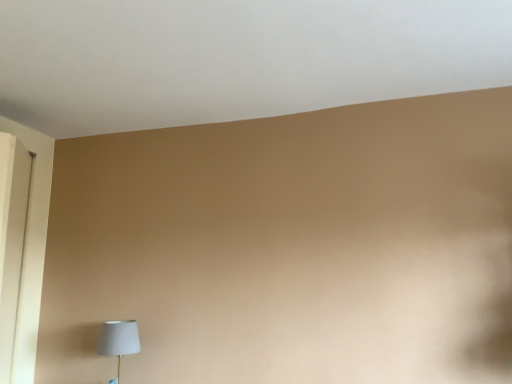
In order to click on matte gray lampshade at lower left in this screenshot , I will do tap(119, 340).

In the scene shown: What is the approximate height of matte gray lampshade at lower left?

16.19 inches.

This screenshot has width=512, height=384. What do you see at coordinates (119, 340) in the screenshot?
I see `matte gray lampshade at lower left` at bounding box center [119, 340].

Locate an element on the screen. This screenshot has height=384, width=512. matte gray lampshade at lower left is located at coordinates (119, 340).